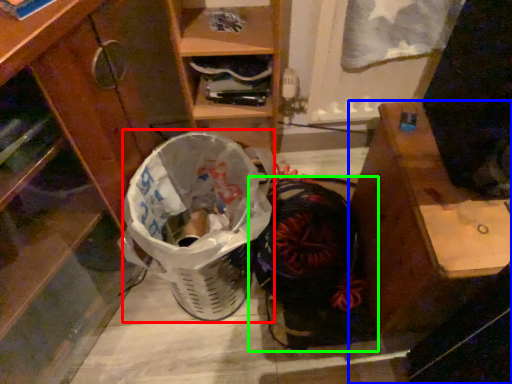
Question: Considering the real-world distances, which object is farthest from shopping basket (highlighted by a red box)? desk (highlighted by a blue box) or footwear (highlighted by a green box)?

Choices:
 (A) desk
 (B) footwear

Answer: (A)